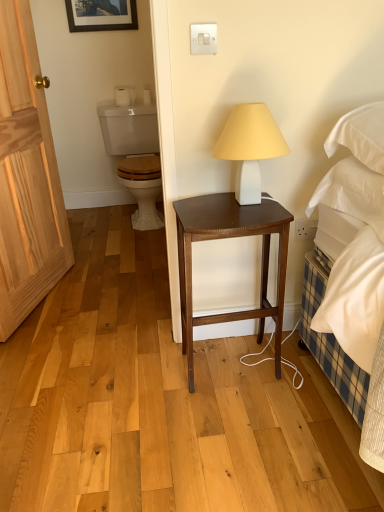
Find the location of a particular element. vacant space underneath dark wood stool at center (from a real-world perspective) is located at coordinates (237, 360).